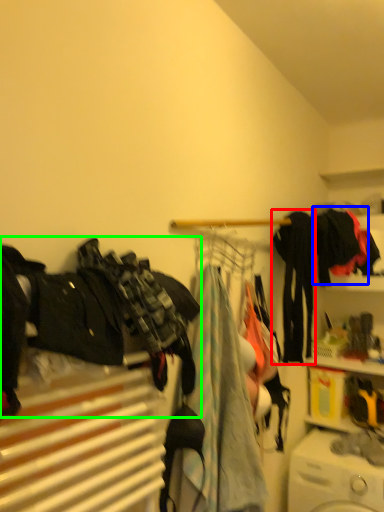
Question: Which object is the closest to the clothing (highlighted by a red box)? Choose among these: clothing (highlighted by a blue box) or clothing (highlighted by a green box).

Choices:
 (A) clothing
 (B) clothing

Answer: (A)